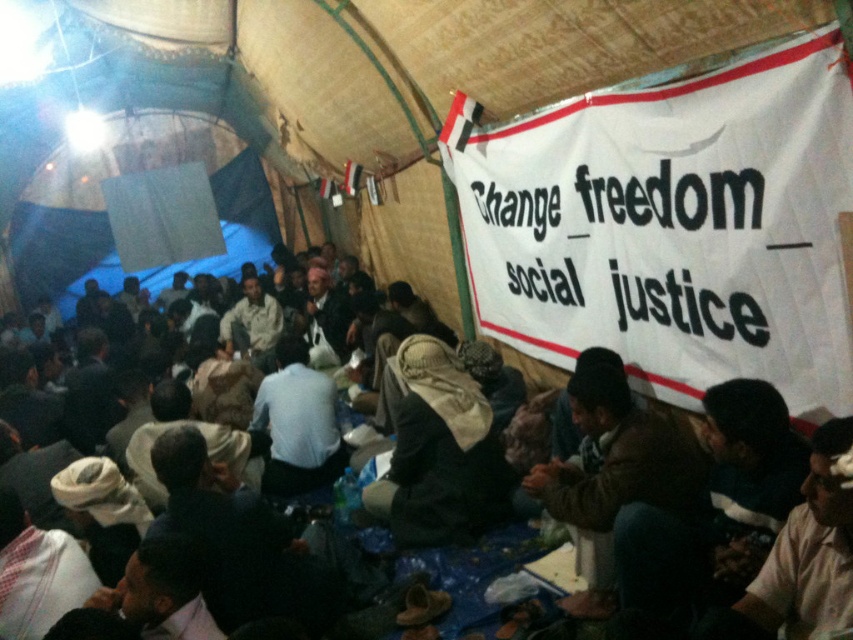
You are a photographer standing at the entrance of the tent. You want to take a photo of the white textured shirt at lower right and the dark brown leather jacket at center. The camera you have can focus on objects within a 4 meter range. Will both objects be in focus?

The white textured shirt at lower right is 3.82 meters away from the dark brown leather jacket at center. Since the camera can focus within 4 meters, both objects are within the required distance and will be in focus.

You are standing in the dimly lit tented area and notice a point marked at coordinates (809, 552). Based on the scene description, what object or feature is located at that specific coordinate?

The point at coordinates (809, 552) indicates the white textured shirt at lower right.